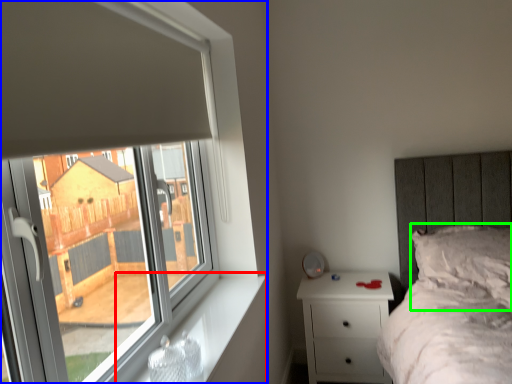
Question: Based on their relative distances, which object is farther from window sill (highlighted by a red box)? Choose from window (highlighted by a blue box) and pillow (highlighted by a green box).

Choices:
 (A) window
 (B) pillow

Answer: (B)